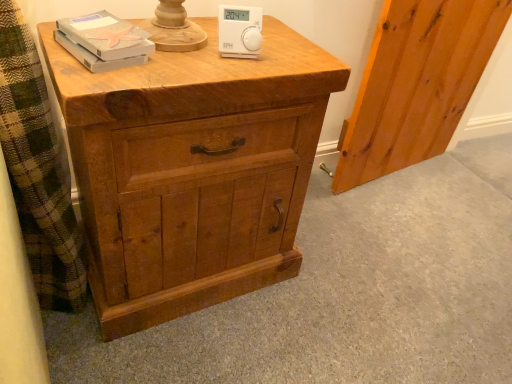
Locate an element on the screen. free location to the right of natural wood screen door at right is located at coordinates (457, 182).